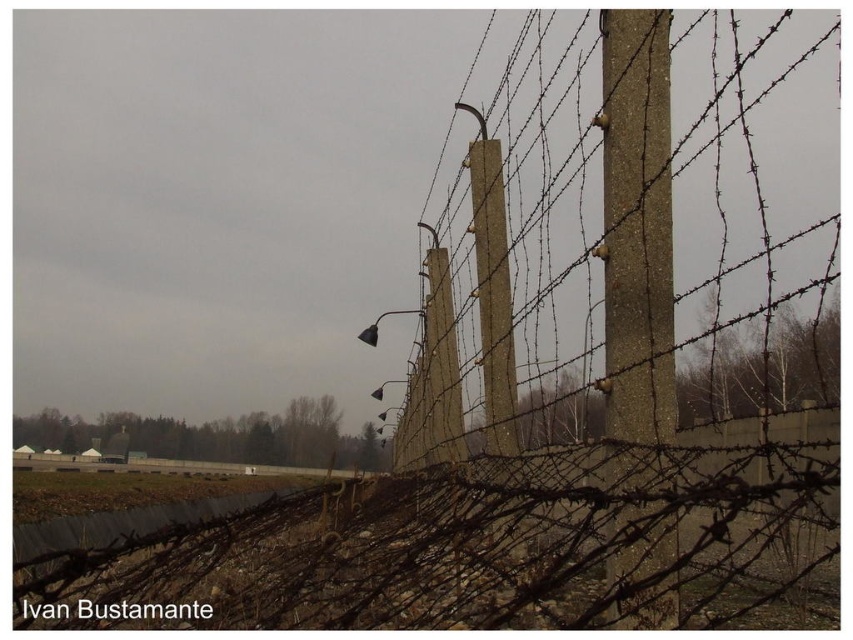
Question: Is concrete wire at center wider than concrete textured pole at center?

Choices:
 (A) no
 (B) yes

Answer: (B)

Question: Among these objects, which one is nearest to the camera?

Choices:
 (A) concrete textured pole at center
 (B) concrete wire at center

Answer: (A)

Question: Which object appears closest to the camera in this image?

Choices:
 (A) concrete wire at center
 (B) concrete textured pole at center

Answer: (B)

Question: Is concrete wire at center further to the viewer compared to concrete textured pole at center?

Choices:
 (A) yes
 (B) no

Answer: (A)

Question: Is concrete wire at center thinner than concrete textured pole at center?

Choices:
 (A) yes
 (B) no

Answer: (B)